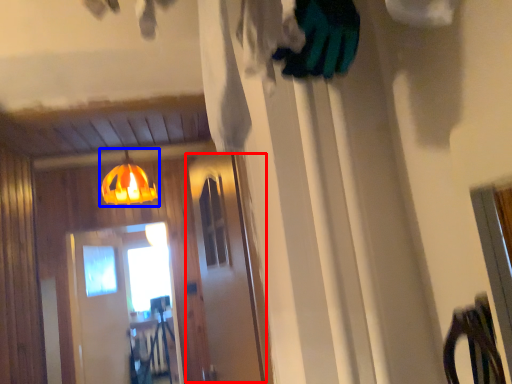
Question: Which object appears farthest to the camera in this image, screen door (highlighted by a red box) or lamp (highlighted by a blue box)?

Choices:
 (A) screen door
 (B) lamp

Answer: (B)